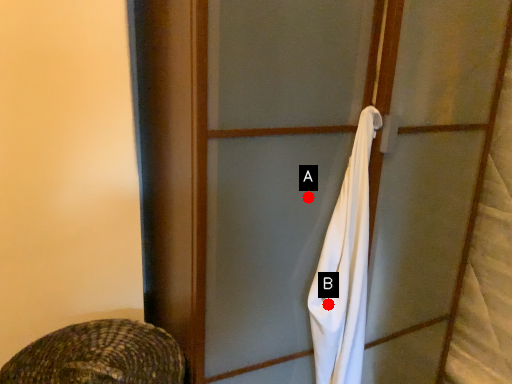
Question: Two points are circled on the image, labeled by A and B beside each circle. Which point appears farthest from the camera in this image?

Choices:
 (A) A is further
 (B) B is further

Answer: (B)